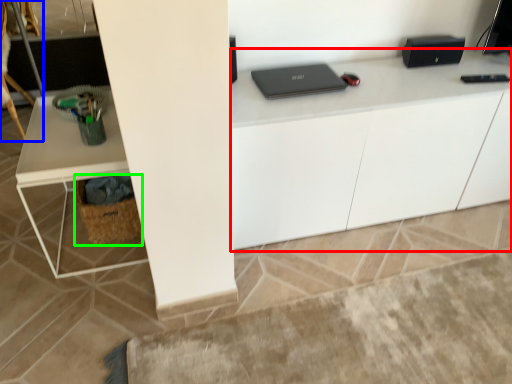
Question: Estimate the real-world distances between objects in this image. Which object is closer to computer desk (highlighted by a red box), swivel chair (highlighted by a blue box) or basket (highlighted by a green box)?

Choices:
 (A) swivel chair
 (B) basket

Answer: (B)